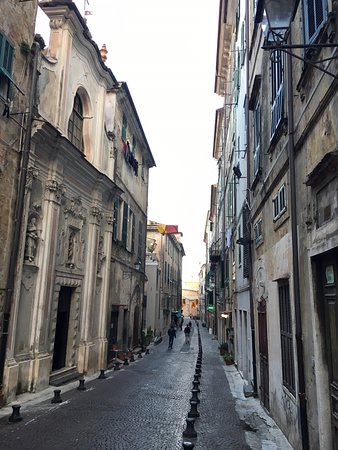
At what (x,y) coordinates should I click in order to perform the action: click on vents. Please return your answer as a coordinate pair (x, y). Image resolution: width=338 pixels, height=450 pixels. Looking at the image, I should click on (7, 57), (279, 204), (255, 231).